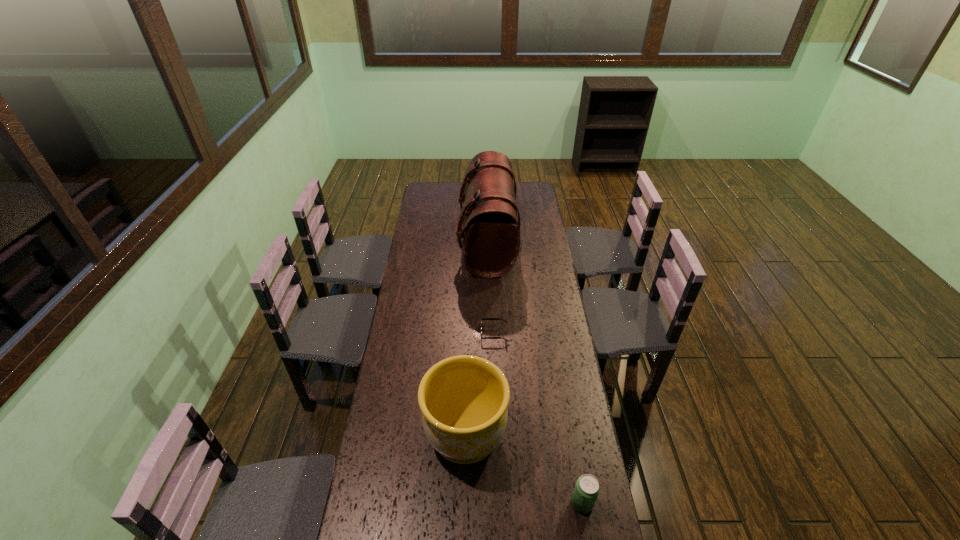
Where is `vacant space located 0.170m on the front-facing side of the tallest object`? The image size is (960, 540). vacant space located 0.170m on the front-facing side of the tallest object is located at coordinates (426, 244).

Image resolution: width=960 pixels, height=540 pixels. In order to click on vacant space located 0.210m on the right of the second nearest object in this screenshot , I will do `click(568, 435)`.

Find the location of a particular element. The width and height of the screenshot is (960, 540). free region located 0.340m on the back of the rightmost object is located at coordinates coord(564,397).

Locate an element on the screen. This screenshot has width=960, height=540. free space located 0.360m at the front lenses of the shortest object is located at coordinates (396, 333).

Where is `vacant region located 0.340m at the front lenses of the shortest object`? vacant region located 0.340m at the front lenses of the shortest object is located at coordinates (400, 333).

Where is `vacant space located at the front lenses of the shortest object`? This screenshot has width=960, height=540. vacant space located at the front lenses of the shortest object is located at coordinates (405, 333).

Find the location of `object situated at the right edge`. object situated at the right edge is located at coordinates (587, 488).

I want to click on vacant space at the left edge of the desktop, so click(x=416, y=273).

This screenshot has width=960, height=540. What are the coordinates of `vacant area at the right edge` in the screenshot? It's located at (531, 269).

Image resolution: width=960 pixels, height=540 pixels. Identify the location of free location at the far left corner of the desktop. (424, 182).